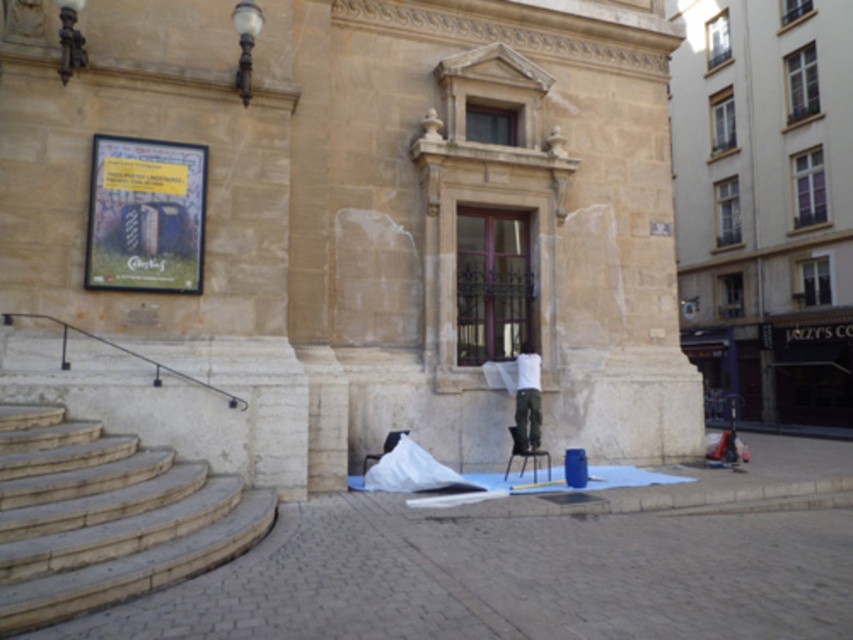
You are a delivery person carrying a heavy box and need to reach the entrance of the historic building. The entrance is above the wooden stairs at lower left. Can you place your box directly on the paved stone pavement at lower center without moving it further?

The paved stone pavement at lower center has a lesser height compared to wooden stairs at lower left. Since the entrance is above the wooden stairs at lower left, the paved stone pavement at lower center is lower in height. Therefore, you can safely place your box directly on the paved stone pavement at lower center without needing to move it further as it is at a lower level.

You are standing in front of the historic building and want to walk towards the entrance. Which surface will you step on first, the paved stone pavement at lower center or the wooden stairs at lower left?

You will step on the paved stone pavement at lower center first because it is closer to you than the wooden stairs at lower left, which are further away.

You are standing on the paved stone pavement at lower center and want to reach the white matte shirt at center. Which direction should you move to get closer to the shirt?

The paved stone pavement at lower center is positioned under the white matte shirt at center, so you should move upward to reach the shirt.